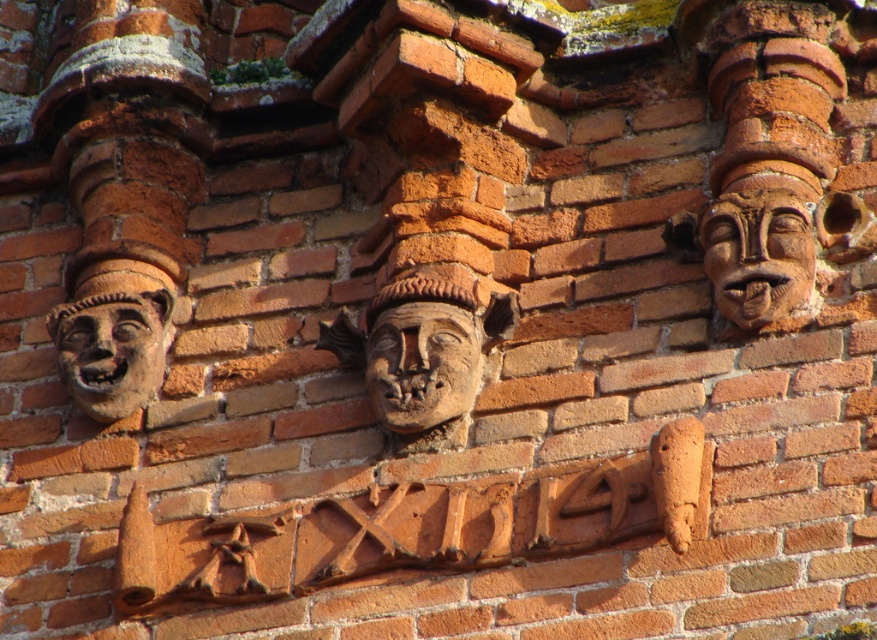
You are an architect examining the brick wall and notice the brown stone face at center and the matte terracotta face at right. Which of these two faces is located higher up on the wall?

The matte terracotta face at right is positioned higher up on the wall because the brown stone face at center is located underneath it.